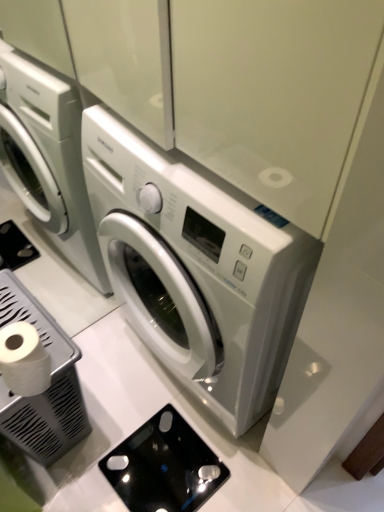
This screenshot has width=384, height=512. I want to click on free area below black glass scale at lower center, acting as the 2th appliance starting from the left (from a real-world perspective), so click(x=177, y=447).